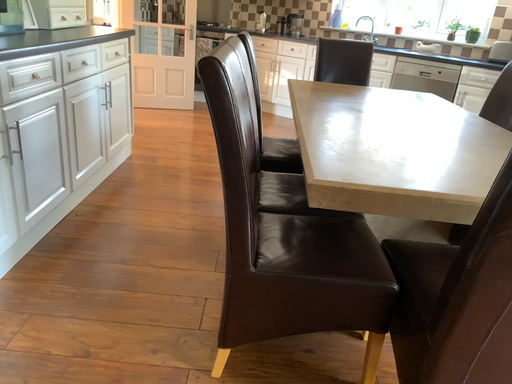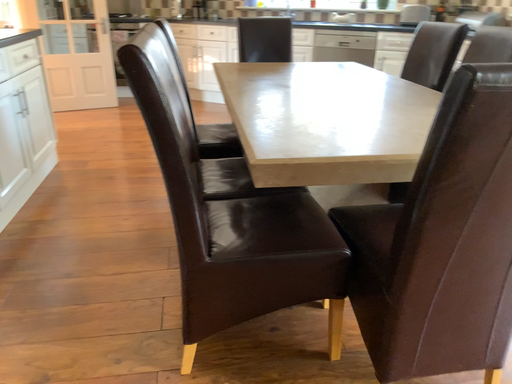
Question: How did the camera likely rotate when shooting the video?

Choices:
 (A) rotated left
 (B) rotated right

Answer: (B)